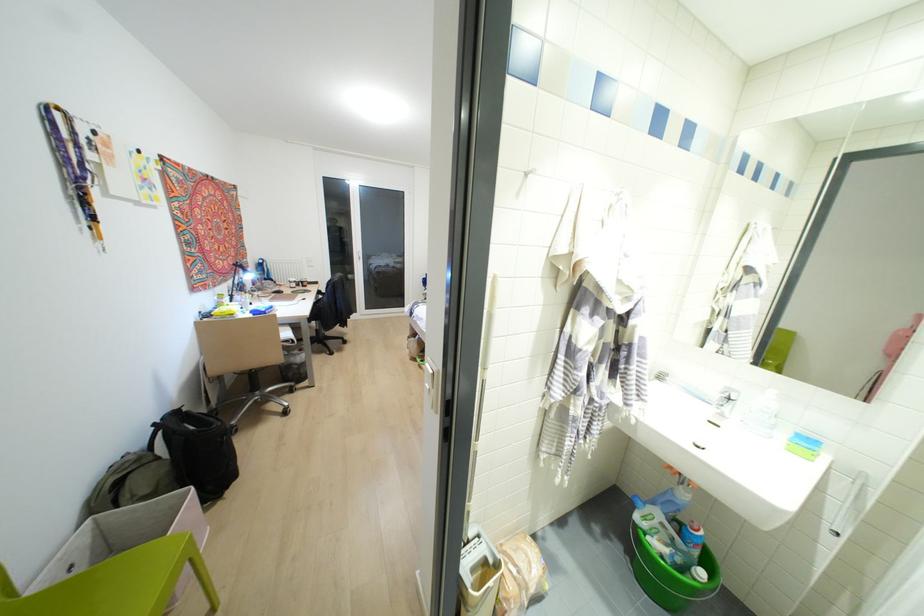
Locate an element on the screen. Image resolution: width=924 pixels, height=616 pixels. white door handle is located at coordinates (431, 379).